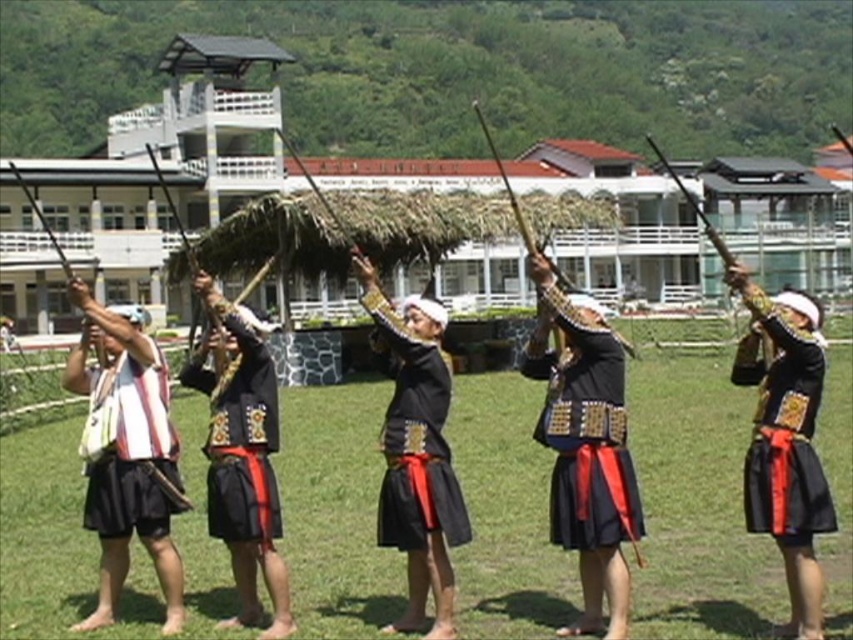
Question: Is green grass at center to the right of black matte skirt at center from the viewer's perspective?

Choices:
 (A) no
 (B) yes

Answer: (A)

Question: Does black satin robe at center have a lesser width compared to black satin skirt at center?

Choices:
 (A) yes
 (B) no

Answer: (A)

Question: Which point is closer to the camera?

Choices:
 (A) (805, 339)
 (B) (439, 396)
 (C) (622, 400)
 (D) (132, 492)

Answer: (A)

Question: Which of the following is the closest to the observer?

Choices:
 (A) [x=786, y=449]
 (B) [x=393, y=403]
 (C) [x=233, y=486]
 (D) [x=566, y=596]

Answer: (A)

Question: Which point is farther to the camera?

Choices:
 (A) (41, 502)
 (B) (563, 358)
 (C) (469, 528)

Answer: (A)

Question: Does striped fabric bag at left appear on the right side of white striped fabric at left?

Choices:
 (A) no
 (B) yes

Answer: (A)